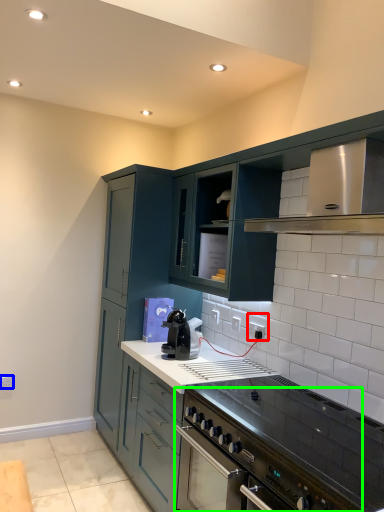
Question: Considering the real-world distances, which object is closest to electric outlet (highlighted by a red box)? electric outlet (highlighted by a blue box) or kitchen appliance (highlighted by a green box).

Choices:
 (A) electric outlet
 (B) kitchen appliance

Answer: (B)